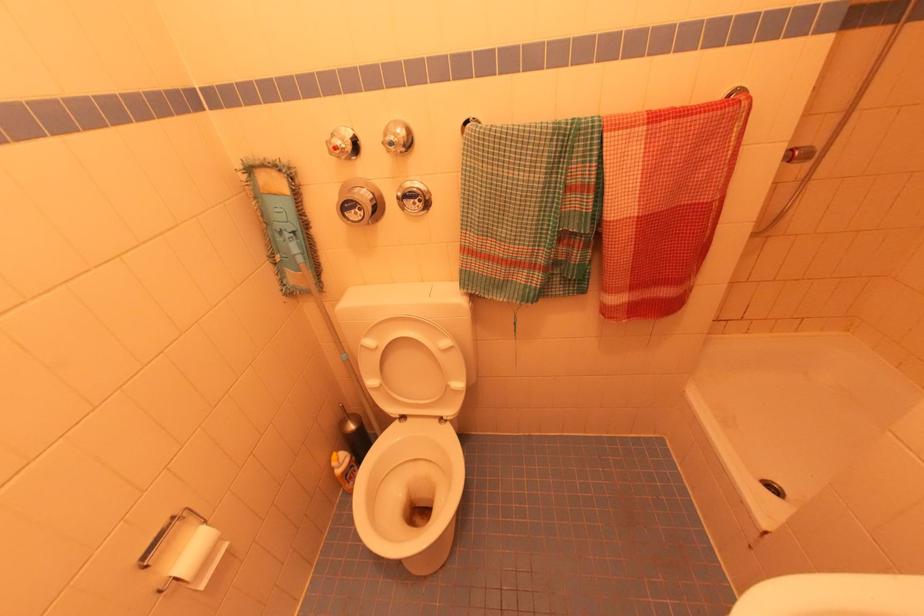
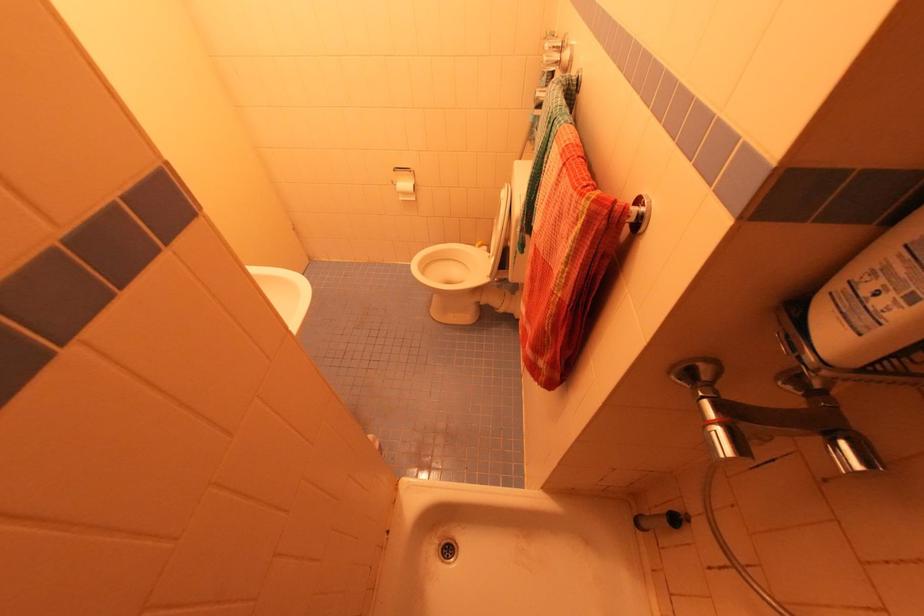
Find the pixel in the second image that matches point (204, 586) in the first image.

(403, 200)